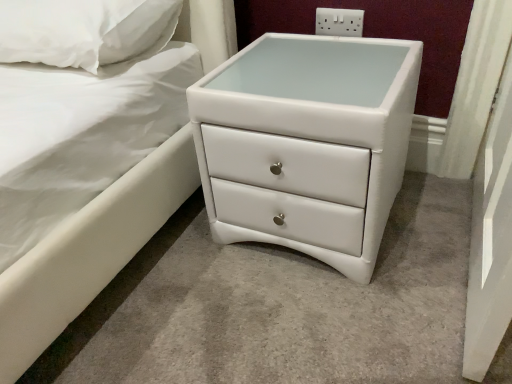
Question: Does point (101, 13) appear closer or farther from the camera than point (362, 127)?

Choices:
 (A) closer
 (B) farther

Answer: (B)

Question: From a real-world perspective, is white soft pillow at upper left physically located above or below white glossy chest of drawers at lower right?

Choices:
 (A) below
 (B) above

Answer: (B)

Question: Which is nearer to the white plastic electrical outlet at upper center?

Choices:
 (A) white glossy chest of drawers at lower right
 (B) white soft pillow at upper left

Answer: (A)

Question: Estimate the real-world distances between objects in this image. Which object is closer to the white plastic electrical outlet at upper center?

Choices:
 (A) white glossy chest of drawers at lower right
 (B) white soft pillow at upper left

Answer: (A)